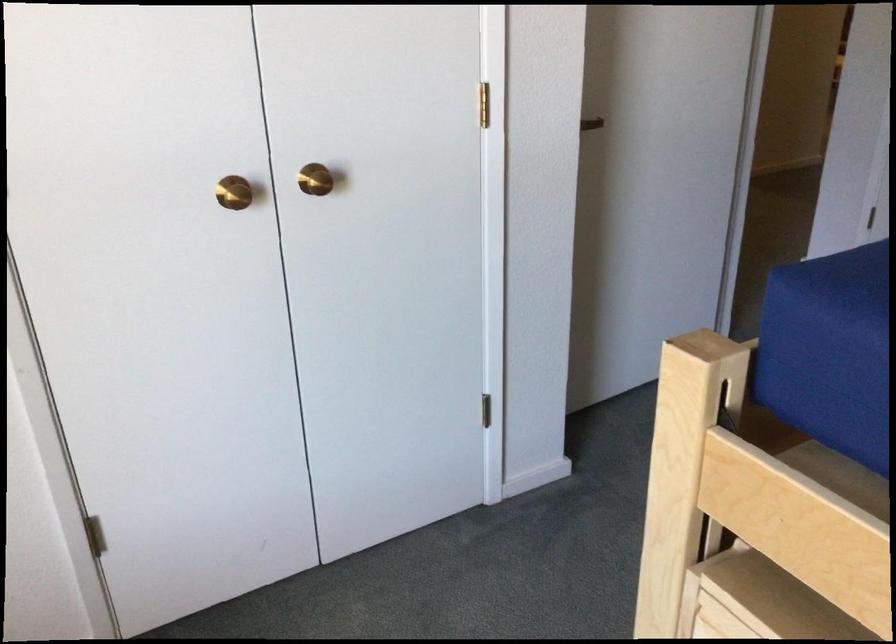
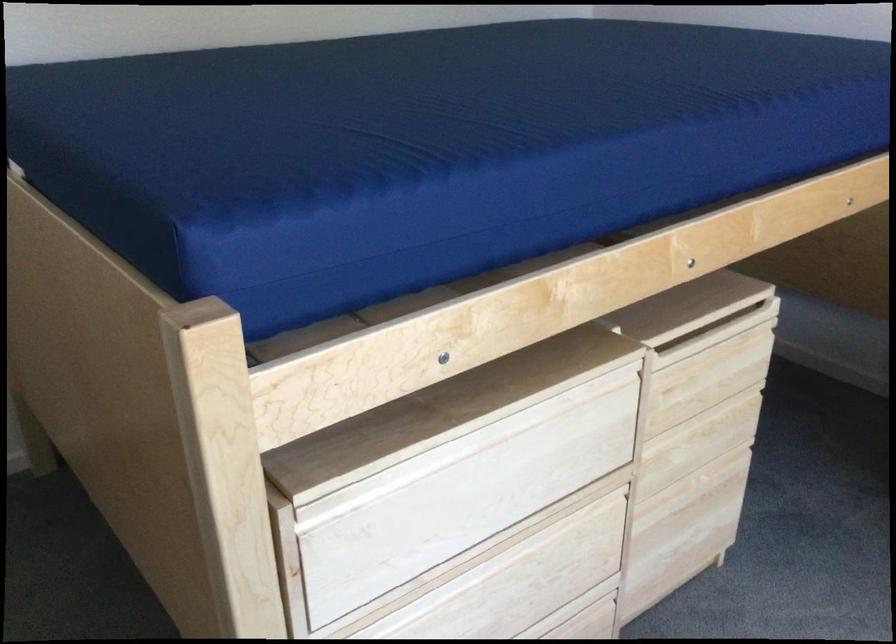
First-person continuous shooting, in which direction is the camera rotating?

The camera rotated toward right-down.